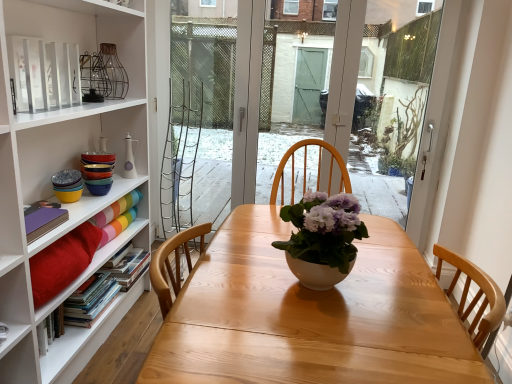
Question: Relative to wooden table at center, is matte rainbow paper at left, the first book from the top, in front or behind?

Choices:
 (A) front
 (B) behind

Answer: (B)

Question: From their relative heights in the image, would you say matte rainbow paper at left, which ranks as the 4th book in bottom-to-top order, is taller or shorter than wooden table at center?

Choices:
 (A) tall
 (B) short

Answer: (B)

Question: Which object is positioned farthest from the matte rainbow paper at left, the first book from the top?

Choices:
 (A) purple matte book at left, the third book ordered from the bottom
 (B) hardcover book at left, acting as the 1th book starting from the bottom
 (C) wooden table at center
 (D) matte white vase at upper left
 (E) hardcover books at left, the 2th book ordered from the bottom

Answer: (C)

Question: Which is nearer to the white matte vase at center?

Choices:
 (A) hardcover book at left, acting as the 1th book starting from the bottom
 (B) purple matte book at left, the third book ordered from the bottom
 (C) wooden table at center
 (D) matte rainbow paper at left, the first book from the top
 (E) hardcover books at left, the 2th book ordered from the bottom

Answer: (C)